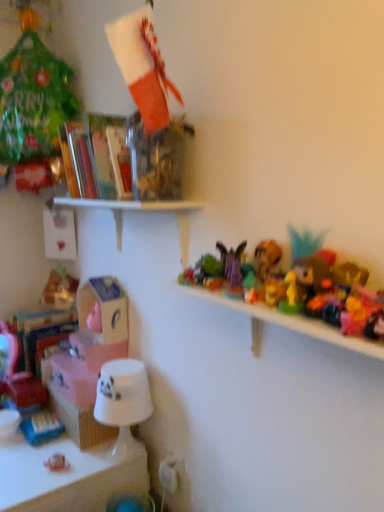
Find the location of a particular element. Image resolution: width=384 pixels, height=512 pixels. free area below white glossy lampshade at lower left (from a real-world perspective) is located at coordinates (123, 449).